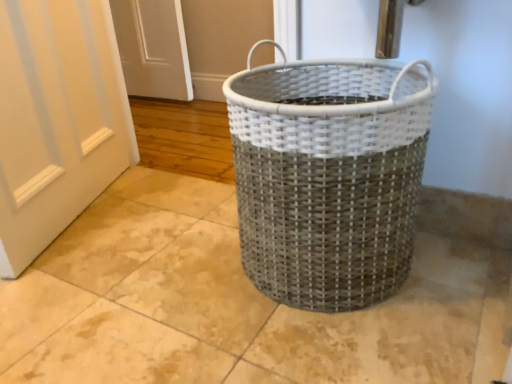
Find the location of `vacant region in front of white woven basket at center`. vacant region in front of white woven basket at center is located at coordinates (342, 349).